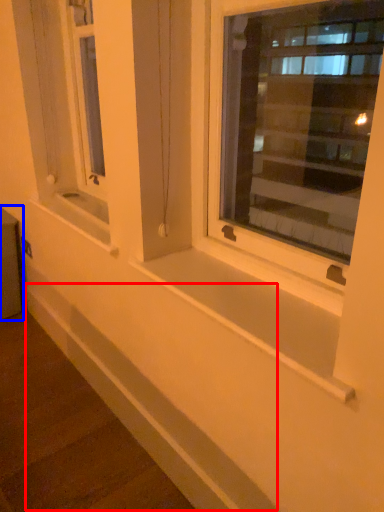
Question: Which object appears closest to the camera in this image, ledge (highlighted by a red box) or window box (highlighted by a blue box)?

Choices:
 (A) ledge
 (B) window box

Answer: (A)